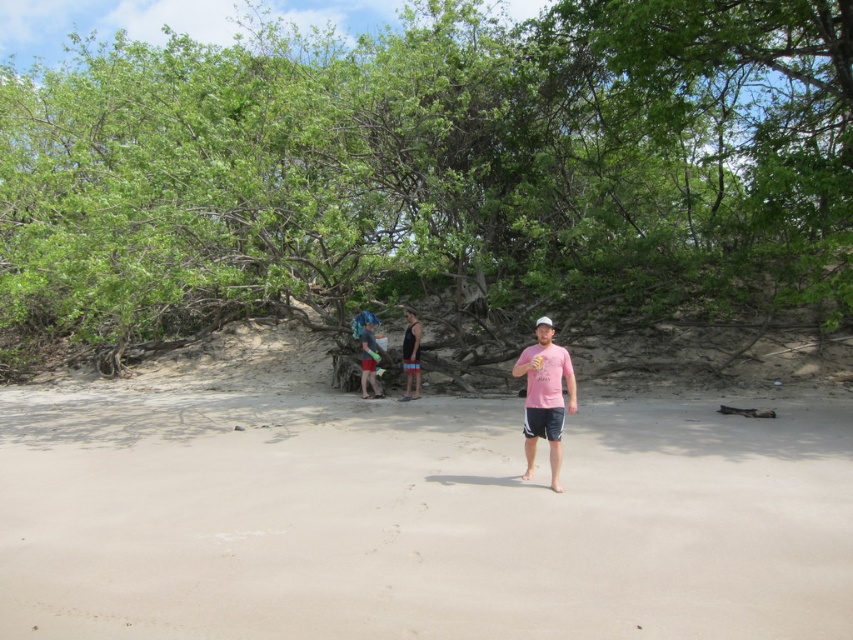
You are planning to set up a picnic blanket in the beach scene. The picnic blanket is 3 meters wide. You want to place it between the green leafy tree at center and the light beige sand at center. Based on the scene description, will the space between them accommodate the blanket?

The green leafy tree at center might be wider than light beige sand at center, so the space between them may be sufficient to place a 3 meter wide picnic blanket.

You are standing on the beach and want to walk to both the point at coordinates point (50, 508) and point (407, 308). Which point should you reach first to minimize the distance walked?

You should reach point (50, 508) first because it is closer to the viewer than point (407, 308) according to the description.